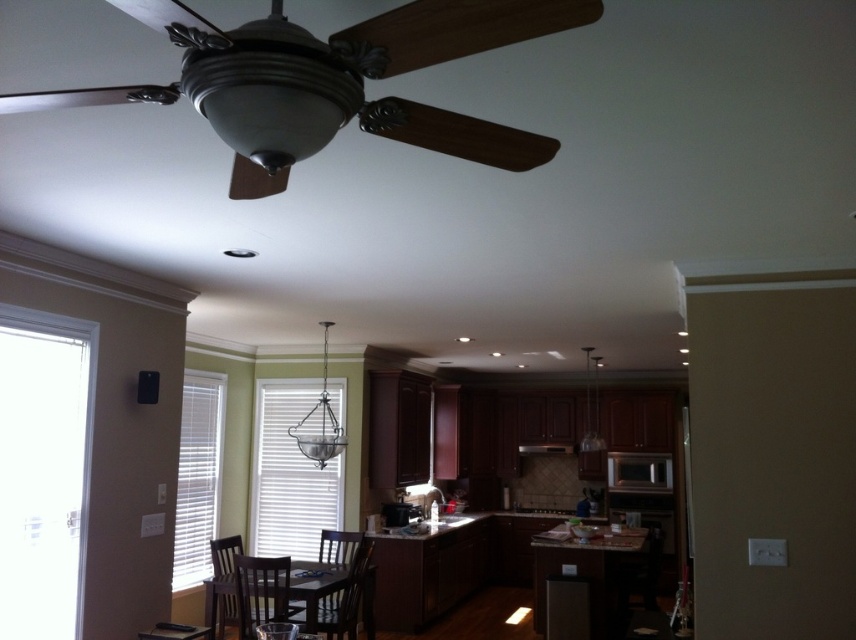
You are a home inspector checking the kitchen layout. You notice the metallic brown ceiling fan at upper center and the black glossy microwave at center. According to safety regulations, ceiling fans must be positioned at least 7 feet above any appliances below them. Can you determine if the ceiling fan is safely positioned above the microwave?

The metallic brown ceiling fan at upper center is above the black glossy microwave at center, but the exact distance isn not provided. Safety regulations require at least 7 feet clearance. Without knowing the actual height, I cannot confirm if it meets the requirement.

Looking at this image, you are designing a layout for a new kitchen and need to ensure that the metallic brown ceiling fan at upper center and the satin nickel exhaust hood at center will fit within the available space. Based on their widths, which one requires more horizontal space?

The metallic brown ceiling fan at upper center requires more horizontal space because its width surpasses that of the satin nickel exhaust hood at center.